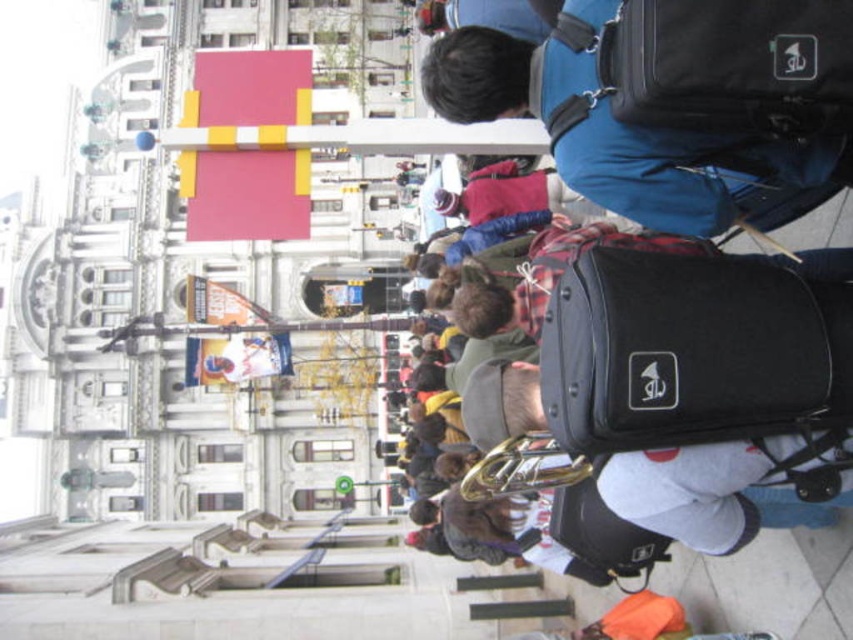
You are a photographer standing in the plaza and want to take a photo that includes both the blue fabric backpack at upper right and the gold shiny trumpet at center. Which object should you focus on first to ensure both are in sharp focus?

You should focus on the blue fabric backpack at upper right first because it is closer to you than the gold shiny trumpet at center, ensuring both will be in focus when using depth of field appropriately.

You are a photographer trying to capture a clear shot of the gold shiny trumpet at center without the blue fabric backpack at upper right blocking it. Since the backpack is much taller than the trumpet, where should you position yourself to ensure the trumpet is fully visible?

The blue fabric backpack at upper right is much taller than the gold shiny trumpet at center, so positioning yourself below the backpack and aiming upwards will allow the trumpet to be visible above the backpack.

You are a tourist in the plaza and need to find your luggage. You see a black fabric suitcase at center and a blue fabric backpack at upper right. Which item is located to the right of the other?

The black fabric suitcase at center is positioned on the right side of blue fabric backpack at upper right.